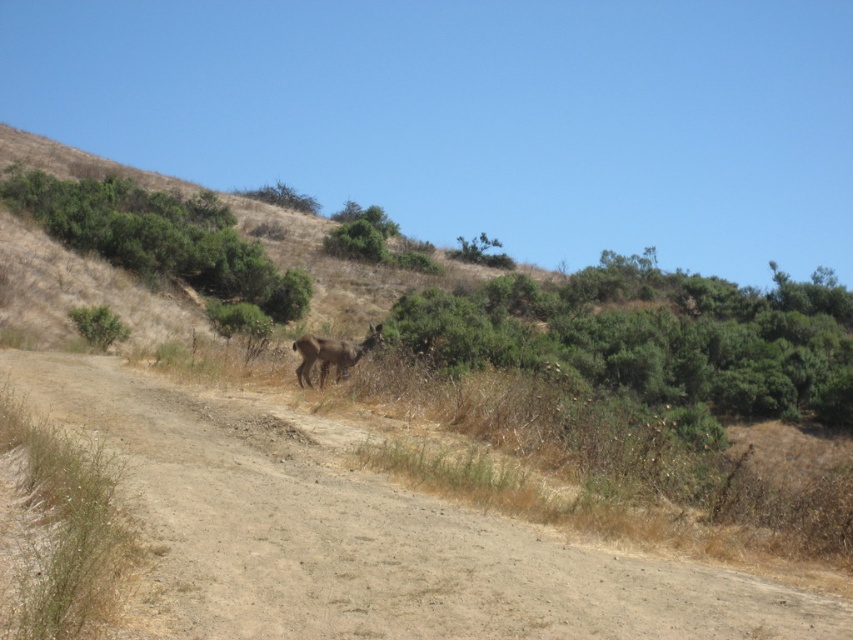
Question: Which of the following is the closest to the observer?

Choices:
 (A) brown dirt track at center
 (B) brown furry deer at center

Answer: (A)

Question: From the image, what is the correct spatial relationship of brown dirt track at center in relation to brown furry deer at center?

Choices:
 (A) left
 (B) right

Answer: (B)

Question: Is brown dirt track at center to the right of brown furry deer at center from the viewer's perspective?

Choices:
 (A) no
 (B) yes

Answer: (B)

Question: Where is brown dirt track at center located in relation to brown furry deer at center in the image?

Choices:
 (A) right
 (B) left

Answer: (A)